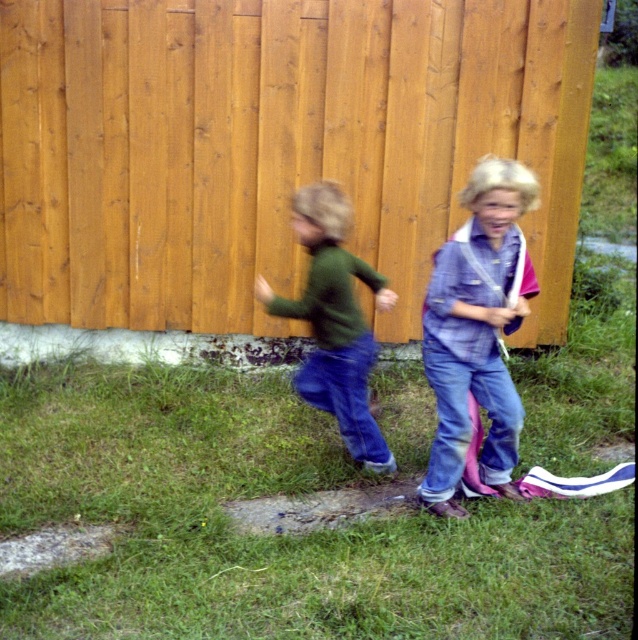
Which of these two, green grass at lower center or denim jeans at right, stands taller?

denim jeans at right is taller.

Looking at this image, measure the distance between point [387,529] and camera.

A distance of 12.25 feet exists between point [387,529] and camera.

Does point (13, 374) come behind point (489, 179)?

Yes.

Identify the location of green grass at lower center. This screenshot has width=638, height=640. 272,538.

Measure the distance between green grass at lower center and camera.

green grass at lower center is 9.84 feet away from camera.

Does green grass at lower center have a smaller size compared to green matte shirt at center?

No.

Which is behind, point (389, 548) or point (345, 307)?

Positioned behind is point (345, 307).

Where is `green grass at lower center`? green grass at lower center is located at coordinates (272, 538).

Who is lower down, denim jeans at right or green matte shirt at center?

denim jeans at right is below.

From the picture: Between denim jeans at right and green matte shirt at center, which one appears on the right side from the viewer's perspective?

From the viewer's perspective, denim jeans at right appears more on the right side.

Find the location of a particular element. denim jeans at right is located at coordinates (477, 332).

Where is `denim jeans at right`? The image size is (638, 640). denim jeans at right is located at coordinates (477, 332).